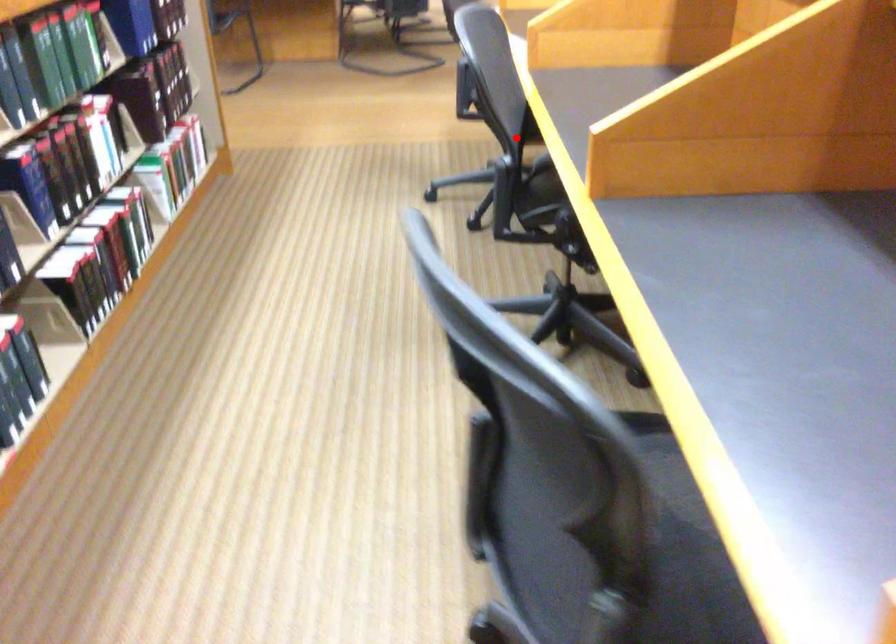
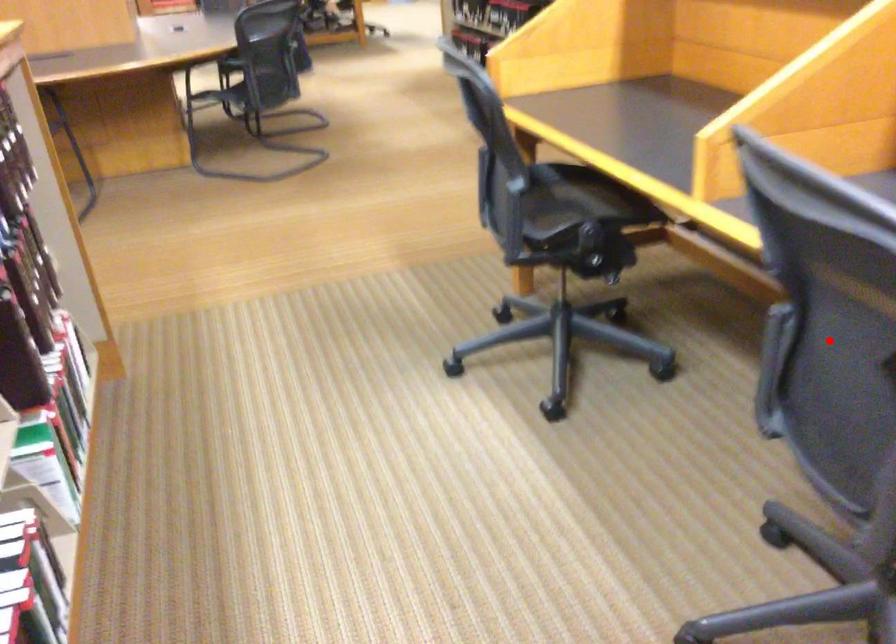
I am providing you with two images of the same scene from different viewpoints. A red point is marked on the first image and another point is marked on the second image. Are the points marked in image1 and image2 representing the same 3D position?

Yes